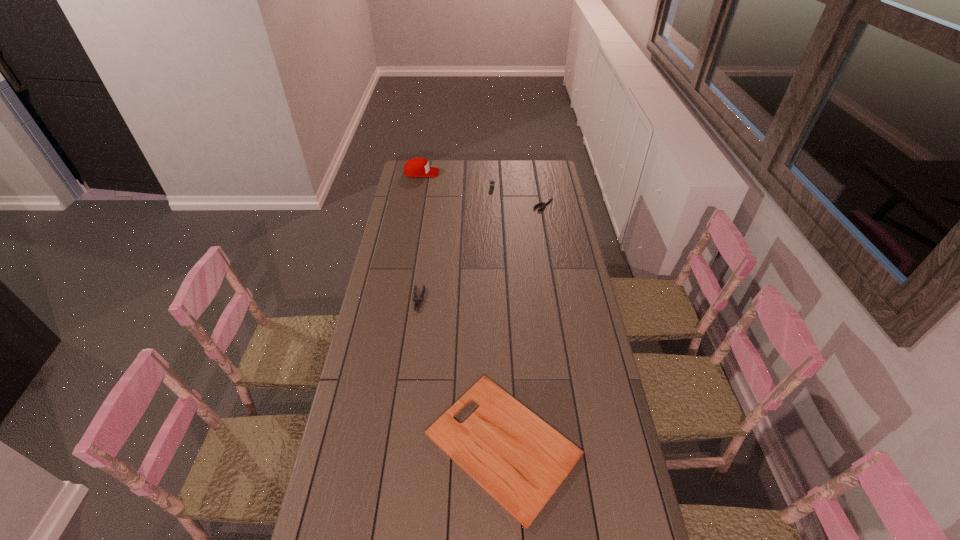
I want to click on free area in between the left pliers and the nearest object, so click(x=461, y=372).

Locate an element on the screen. This screenshot has height=540, width=960. object that stands as the fourth closest to the beer can is located at coordinates (517, 458).

Point out which object is positioned as the second nearest to the chopping board. Please provide its 2D coordinates. Your answer should be formatted as a tuple, i.e. [(x, y)], where the tuple contains the x and y coordinates of a point satisfying the conditions above.

[(548, 200)]

Identify the location of pliers that can be found as the closest to the farthest object. This screenshot has width=960, height=540. (548, 200).

Where is `the closest pliers relative to the tallest object`? This screenshot has width=960, height=540. the closest pliers relative to the tallest object is located at coordinates (548, 200).

The image size is (960, 540). I want to click on free space that satisfies the following two spatial constraints: 1. at the gripping part of the second nearest object; 2. on the right side of the chopping board, so click(x=398, y=444).

Locate an element on the screen. This screenshot has height=540, width=960. blank area in the image that satisfies the following two spatial constraints: 1. on the front-facing side of the nearest object; 2. on the right side of the baseball cap is located at coordinates (372, 444).

At what (x,y) coordinates should I click in order to perform the action: click on vacant space that satisfies the following two spatial constraints: 1. on the front-facing side of the second tallest object; 2. on the left side of the tallest object. Please return your answer as a coordinate pair (x, y). Image resolution: width=960 pixels, height=540 pixels. Looking at the image, I should click on (x=419, y=187).

Locate an element on the screen. vacant region that satisfies the following two spatial constraints: 1. on the front-facing side of the second farthest object; 2. on the right side of the baseball cap is located at coordinates (419, 187).

Locate an element on the screen. Image resolution: width=960 pixels, height=540 pixels. free location that satisfies the following two spatial constraints: 1. on the front-facing side of the right pliers; 2. on the right side of the tallest object is located at coordinates (416, 205).